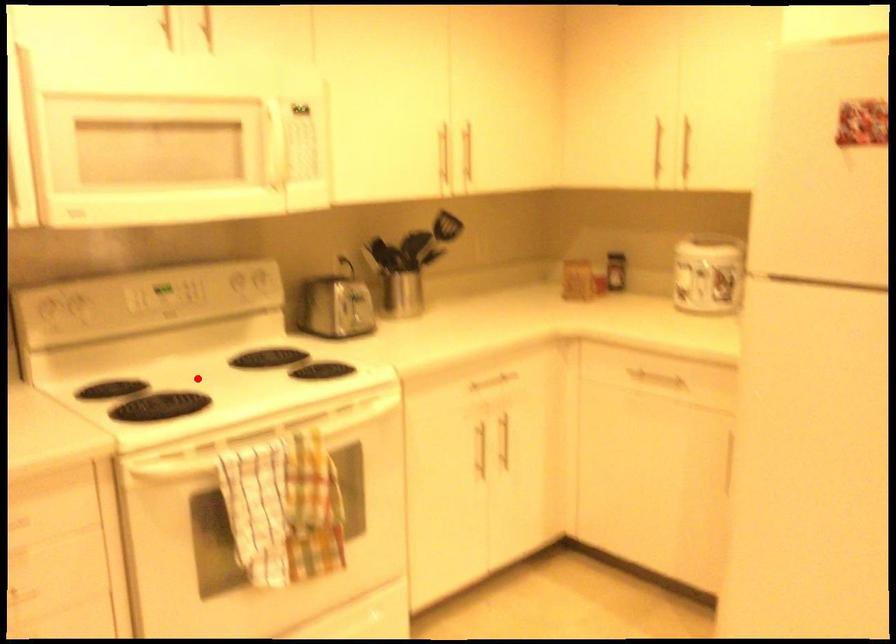
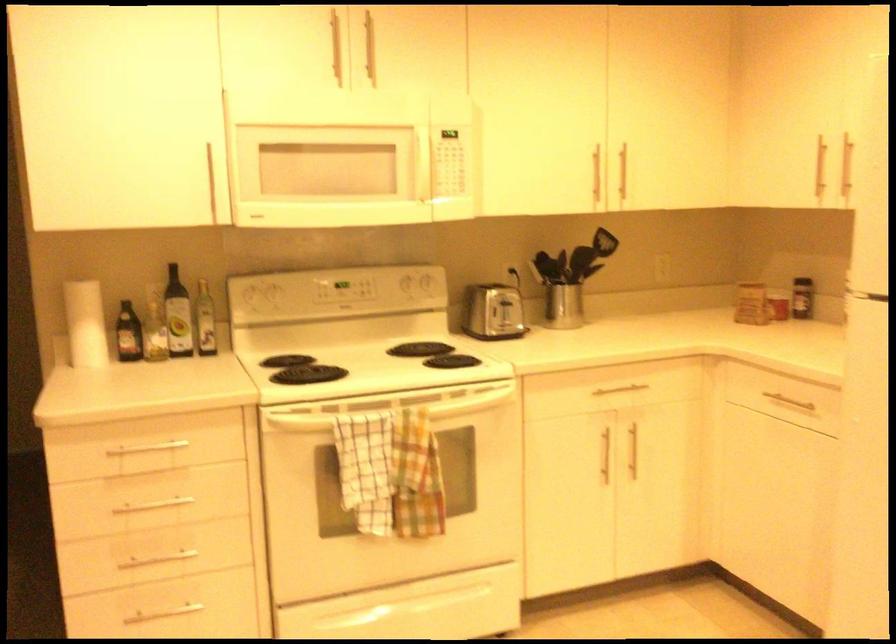
In the second image, find the point that corresponds to the highlighted location in the first image.

(364, 363)